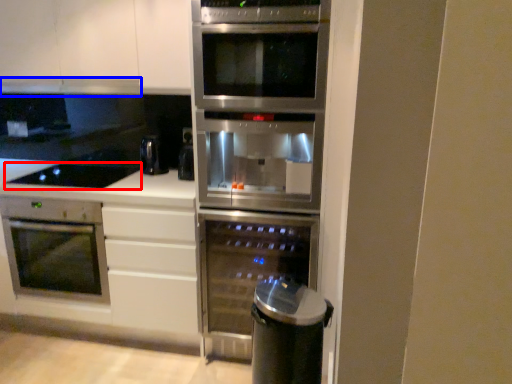
Question: Which object is further to the camera taking this photo, gas stove (highlighted by a red box) or exhaust hood (highlighted by a blue box)?

Choices:
 (A) gas stove
 (B) exhaust hood

Answer: (B)